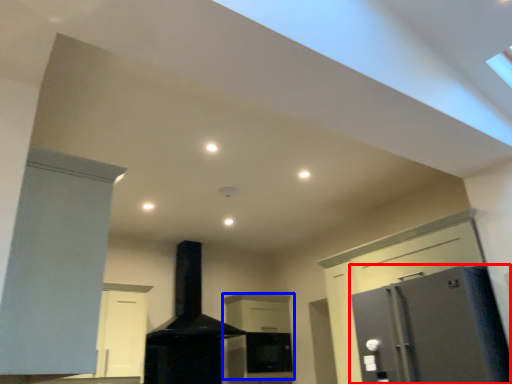
Question: Which object appears closest to the camera in this image, refrigerator (highlighted by a red box) or cabinetry (highlighted by a blue box)?

Choices:
 (A) refrigerator
 (B) cabinetry

Answer: (A)